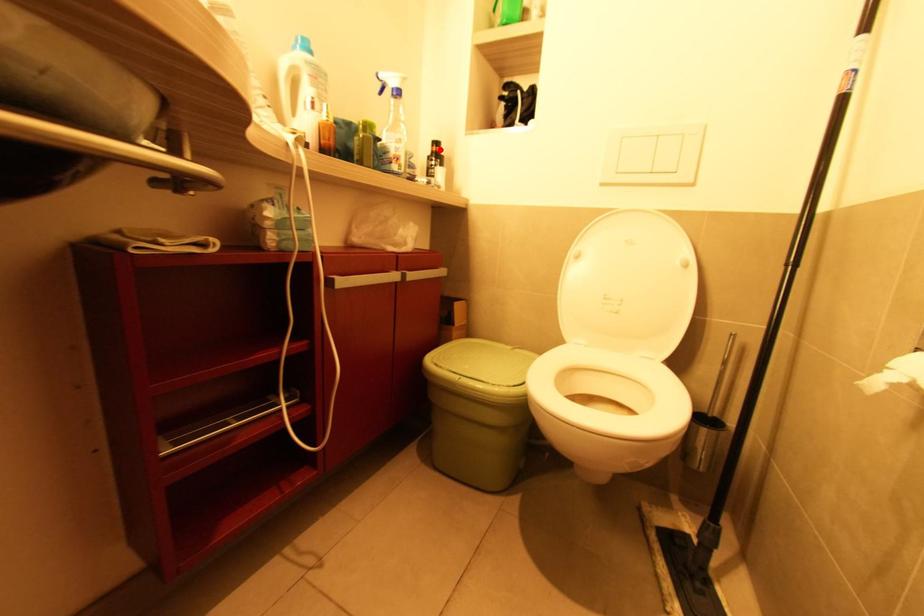
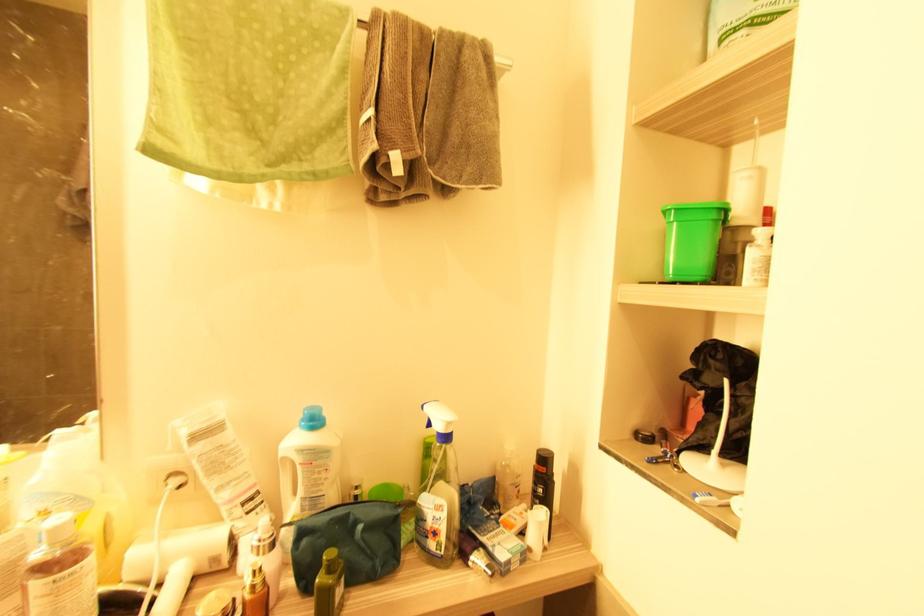
The point at the highlighted location is marked in the first image. Where is the corresponding point in the second image?

(545, 469)